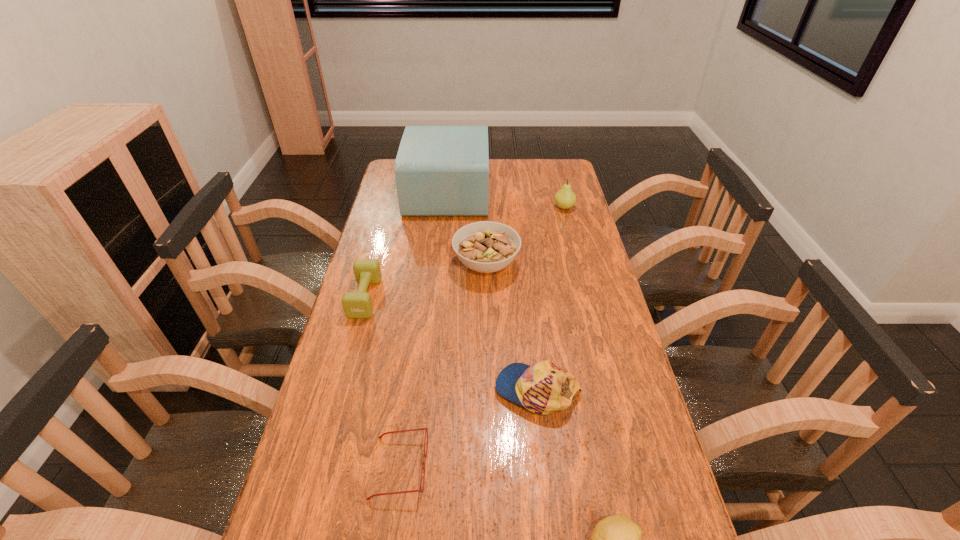
Where is `object that is at the far left corner`? This screenshot has width=960, height=540. object that is at the far left corner is located at coordinates (440, 170).

The height and width of the screenshot is (540, 960). I want to click on free spot at the far edge of the desktop, so click(x=529, y=180).

Identify the location of vacant space at the left edge. The height and width of the screenshot is (540, 960). (366, 324).

Identify the location of vacant space at the right edge of the desktop. (540, 199).

Identify the location of vacant space at the far left corner. The height and width of the screenshot is (540, 960). (391, 176).

I want to click on free space at the far right corner of the desktop, so click(562, 180).

What are the coordinates of `empty location between the shortest object and the fifth farthest object` in the screenshot? It's located at (468, 428).

Where is `vacant area between the second nearest object and the second tallest object`? vacant area between the second nearest object and the second tallest object is located at coordinates (482, 337).

The width and height of the screenshot is (960, 540). I want to click on vacant region between the shortest object and the stew, so click(443, 366).

The height and width of the screenshot is (540, 960). Find the location of `vacant area that lies between the spectacles and the second tallest object`. vacant area that lies between the spectacles and the second tallest object is located at coordinates (482, 337).